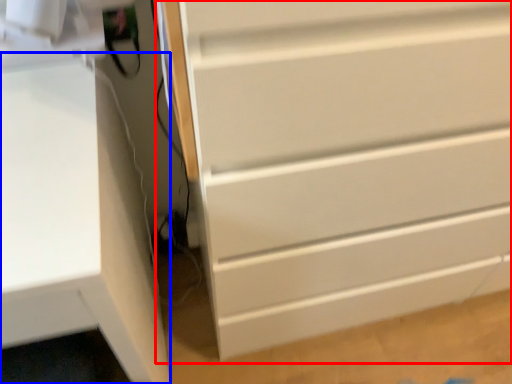
Question: Which object is further to the camera taking this photo, chest of drawers (highlighted by a red box) or computer desk (highlighted by a blue box)?

Choices:
 (A) chest of drawers
 (B) computer desk

Answer: (A)